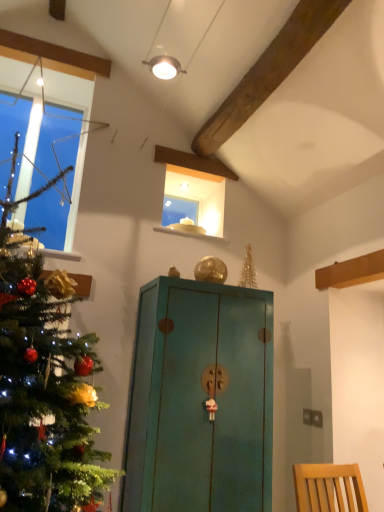
Question: Does clear glass window at left have a smaller size compared to teal painted wood cabinet at center?

Choices:
 (A) no
 (B) yes

Answer: (B)

Question: From a real-world perspective, is clear glass window at left on top of teal painted wood cabinet at center?

Choices:
 (A) yes
 (B) no

Answer: (A)

Question: Considering the relative sizes of clear glass window at left and teal painted wood cabinet at center in the image provided, is clear glass window at left taller than teal painted wood cabinet at center?

Choices:
 (A) yes
 (B) no

Answer: (B)

Question: Would you say teal painted wood cabinet at center is part of clear glass window at left's contents?

Choices:
 (A) no
 (B) yes

Answer: (A)

Question: Is clear glass window at left facing towards teal painted wood cabinet at center?

Choices:
 (A) no
 (B) yes

Answer: (A)

Question: Does clear glass window at left have a lesser height compared to teal painted wood cabinet at center?

Choices:
 (A) yes
 (B) no

Answer: (A)

Question: From a real-world perspective, is teal painted wood cabinet at center located higher than clear glass window at left?

Choices:
 (A) no
 (B) yes

Answer: (A)

Question: Is teal painted wood cabinet at center at the right side of clear glass window at left?

Choices:
 (A) no
 (B) yes

Answer: (B)

Question: From the image's perspective, is teal painted wood cabinet at center located beneath clear glass window at left?

Choices:
 (A) no
 (B) yes

Answer: (B)

Question: Is the position of teal painted wood cabinet at center less distant than that of clear glass window at left?

Choices:
 (A) no
 (B) yes

Answer: (B)

Question: Is teal painted wood cabinet at center oriented towards clear glass window at left?

Choices:
 (A) yes
 (B) no

Answer: (B)

Question: Can you confirm if teal painted wood cabinet at center is smaller than clear glass window at left?

Choices:
 (A) yes
 (B) no

Answer: (B)

Question: Based on their sizes in the image, would you say teal painted wood cabinet at center is bigger or smaller than clear glass window at left?

Choices:
 (A) small
 (B) big

Answer: (B)